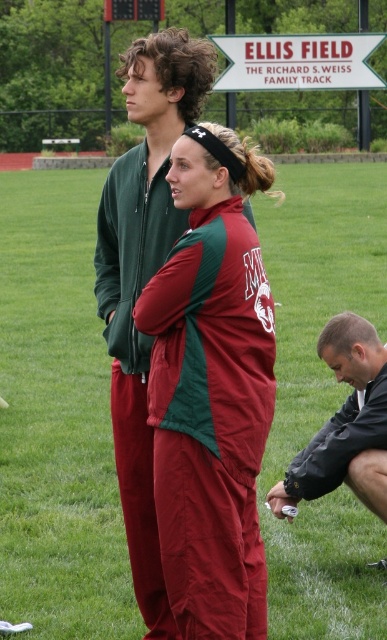
You are a photographer trying to capture both the maroon fabric tracksuit at center and the black matte jacket at lower right in a single frame. Which clothing item should you focus on first to ensure both are in the frame without moving the camera?

The maroon fabric tracksuit at center is bigger than the black matte jacket at lower right, so you should focus on the maroon fabric tracksuit at center first to ensure it fits within the frame before adjusting for the smaller black matte jacket at lower right.

You are a photographer trying to capture a clear shot of both the green grass at center and the maroon fabric tracksuit at center. Which object should you adjust your camera focus to first to ensure both are in frame?

The green grass at center is positioned on the left side of maroon fabric tracksuit at center. Therefore, you should focus on the maroon fabric tracksuit at center first since it is closer to the camera, and then adjust to include the green grass at center in the frame.

You are a photographer trying to capture a clear shot of both the maroon fabric tracksuit at center and the black matte jacket at lower right. Since you want both subjects to be in focus, which one should you focus on first to ensure depth of field covers both?

You should focus on the maroon fabric tracksuit at center first because it is closer to the viewer than the black matte jacket at lower right, so focusing on the closer subject will help include the farther one in the depth of field.